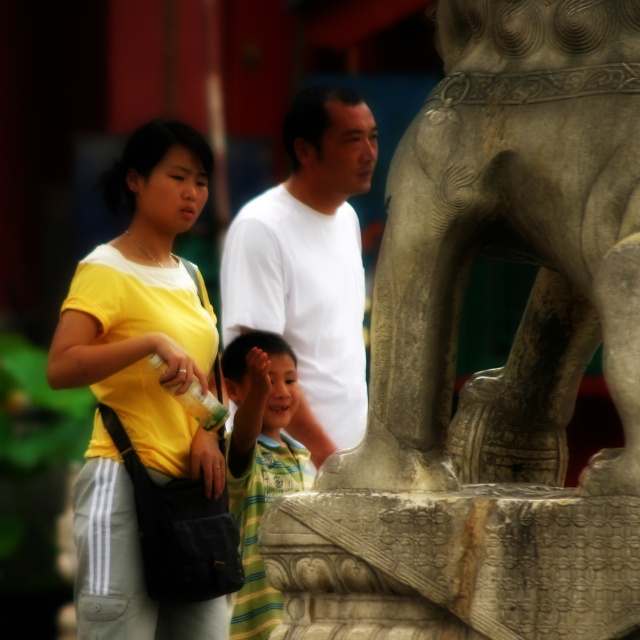
Question: Which object is the farthest from the gray stone statue at right?

Choices:
 (A) yellow matte shirt at center
 (B) white matte shirt at center

Answer: (B)

Question: Is yellow matte shirt at center wider than white matte shirt at center?

Choices:
 (A) no
 (B) yes

Answer: (A)

Question: Which of the following is the farthest from the observer?

Choices:
 (A) (113, 332)
 (B) (456, 140)
 (C) (246, 493)
 (D) (324, 232)

Answer: (D)

Question: From the image, what is the correct spatial relationship of white matte shirt at center in relation to striped cotton shirt at center?

Choices:
 (A) right
 (B) left

Answer: (A)

Question: Considering the real-world distances, which object is farthest from the white matte shirt at center?

Choices:
 (A) gray stone statue at right
 (B) yellow matte shirt at center
 (C) striped cotton shirt at center

Answer: (A)

Question: Can you confirm if gray stone statue at right is positioned to the right of yellow matte shirt at center?

Choices:
 (A) no
 (B) yes

Answer: (B)